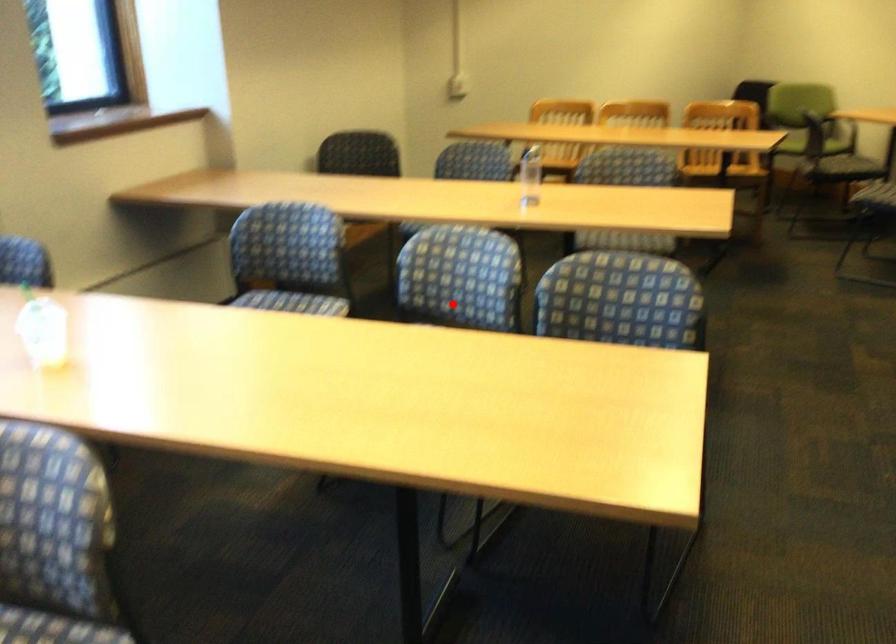
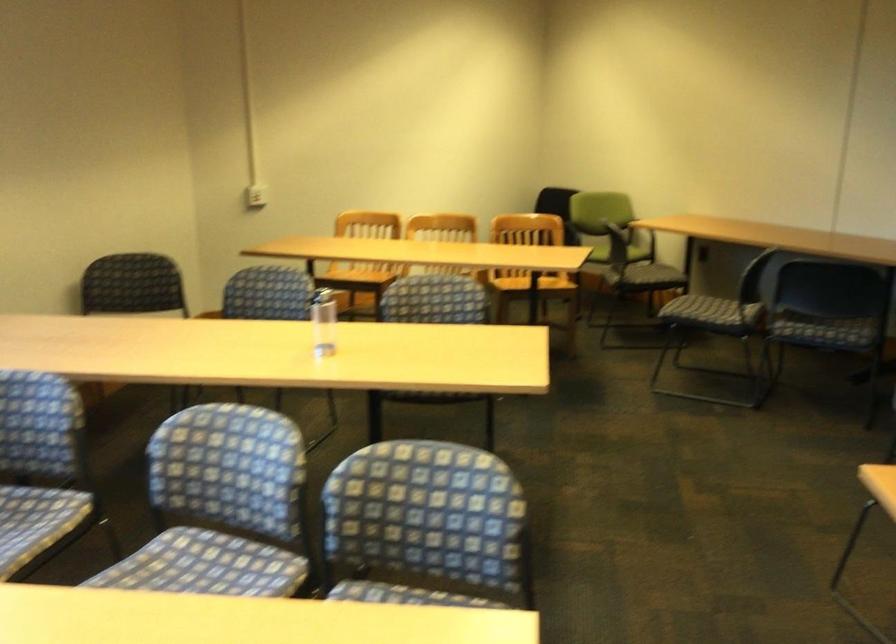
Question: I am providing you with two images of the same scene from different viewpoints. In image1, a red point is highlighted. Considering the same 3D point in image2, which of the following is correct?

Choices:
 (A) It is closer
 (B) It is farther

Answer: (A)